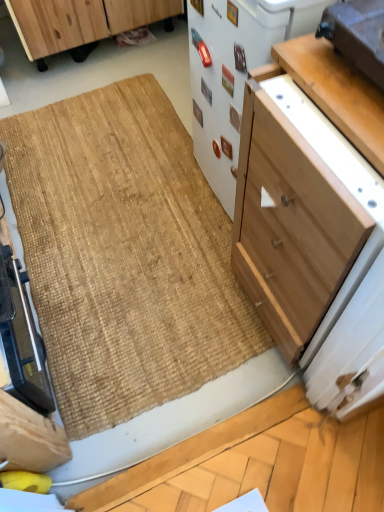
Question: Are white matte refrigerator at center, acting as the second appliance starting from the right, and natural fiber doormat at center far apart?

Choices:
 (A) yes
 (B) no

Answer: (B)

Question: Does white matte refrigerator at center, acting as the second appliance starting from the right, have a larger size compared to natural fiber doormat at center?

Choices:
 (A) yes
 (B) no

Answer: (A)

Question: From the image's perspective, does white matte refrigerator at center, which is counted as the 2th appliance, starting from the left, appear lower than natural fiber doormat at center?

Choices:
 (A) yes
 (B) no

Answer: (B)

Question: Considering the relative sizes of white matte refrigerator at center, which is counted as the 2th appliance, starting from the left, and natural fiber doormat at center in the image provided, is white matte refrigerator at center, which is counted as the 2th appliance, starting from the left, smaller than natural fiber doormat at center?

Choices:
 (A) yes
 (B) no

Answer: (B)

Question: From the image's perspective, is white matte refrigerator at center, which is counted as the 2th appliance, starting from the left, over natural fiber doormat at center?

Choices:
 (A) yes
 (B) no

Answer: (A)

Question: From a real-world perspective, is natural fiber doormat at center above or below light brown wood drawer at upper right?

Choices:
 (A) above
 (B) below

Answer: (B)

Question: Is natural fiber doormat at center taller or shorter than light brown wood drawer at upper right?

Choices:
 (A) short
 (B) tall

Answer: (A)

Question: Considering the positions of natural fiber doormat at center and light brown wood drawer at upper right in the image, is natural fiber doormat at center bigger or smaller than light brown wood drawer at upper right?

Choices:
 (A) big
 (B) small

Answer: (A)

Question: Looking at their shapes, would you say natural fiber doormat at center is wider or thinner than light brown wood drawer at upper right?

Choices:
 (A) thin
 (B) wide

Answer: (B)

Question: Is natural fiber doormat at center bigger or smaller than light wood cabinet at center-right, which is the 2th cabinetry from back to front?

Choices:
 (A) big
 (B) small

Answer: (B)

Question: Considering the positions of point (157, 361) and point (322, 188), is point (157, 361) closer or farther from the camera than point (322, 188)?

Choices:
 (A) closer
 (B) farther

Answer: (B)

Question: From the image's perspective, is natural fiber doormat at center located above or below light wood cabinet at center-right, which is the 2th cabinetry from back to front?

Choices:
 (A) above
 (B) below

Answer: (A)

Question: Relative to light wood cabinet at center-right, which appears as the second cabinetry when viewed from the left, is natural fiber doormat at center in front or behind?

Choices:
 (A) front
 (B) behind

Answer: (B)

Question: Is point (375, 36) closer or farther from the camera than point (225, 194)?

Choices:
 (A) closer
 (B) farther

Answer: (A)

Question: Is matte brown toaster at upper right, the third appliance in the left-to-right sequence, wider or thinner than white matte refrigerator at center, which is counted as the 2th appliance, starting from the left?

Choices:
 (A) thin
 (B) wide

Answer: (A)